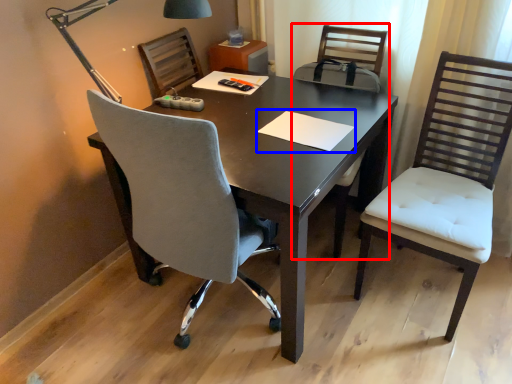
Question: Among these objects, which one is nearest to the camera, armchair (highlighted by a red box) or notepad (highlighted by a blue box)?

Choices:
 (A) armchair
 (B) notepad

Answer: (B)